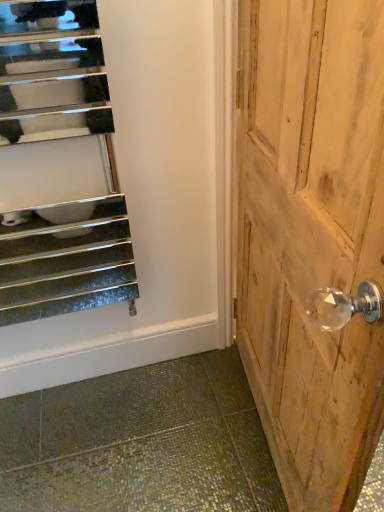
Question: Does wooden door handle at right have a greater height compared to polished chrome radiator at left?

Choices:
 (A) yes
 (B) no

Answer: (A)

Question: Does wooden door handle at right have a smaller size compared to polished chrome radiator at left?

Choices:
 (A) no
 (B) yes

Answer: (A)

Question: Is wooden door handle at right to the left of polished chrome radiator at left from the viewer's perspective?

Choices:
 (A) yes
 (B) no

Answer: (B)

Question: Does wooden door handle at right have a lesser width compared to polished chrome radiator at left?

Choices:
 (A) yes
 (B) no

Answer: (B)

Question: From the image's perspective, is wooden door handle at right on polished chrome radiator at left?

Choices:
 (A) no
 (B) yes

Answer: (A)

Question: Is wooden door handle at right at the right side of polished chrome radiator at left?

Choices:
 (A) yes
 (B) no

Answer: (A)

Question: Does polished chrome radiator at left have a larger size compared to wooden door handle at right?

Choices:
 (A) yes
 (B) no

Answer: (B)

Question: Considering the relative positions of polished chrome radiator at left and wooden door handle at right in the image provided, is polished chrome radiator at left in front of wooden door handle at right?

Choices:
 (A) yes
 (B) no

Answer: (B)

Question: Is wooden door handle at right a part of polished chrome radiator at left?

Choices:
 (A) no
 (B) yes

Answer: (A)

Question: Considering the relative sizes of polished chrome radiator at left and wooden door handle at right in the image provided, is polished chrome radiator at left shorter than wooden door handle at right?

Choices:
 (A) yes
 (B) no

Answer: (A)

Question: Is polished chrome radiator at left smaller than wooden door handle at right?

Choices:
 (A) no
 (B) yes

Answer: (B)

Question: Does polished chrome radiator at left appear on the left side of wooden door handle at right?

Choices:
 (A) yes
 (B) no

Answer: (A)

Question: Is point (8, 55) closer or farther from the camera than point (284, 423)?

Choices:
 (A) closer
 (B) farther

Answer: (A)